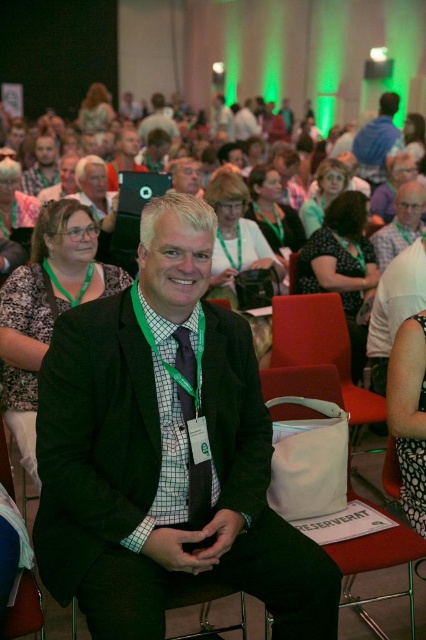
Question: Can you confirm if green woven tie at center is thinner than matte black glasses at center?

Choices:
 (A) no
 (B) yes

Answer: (B)

Question: Which point is closer to the camera?

Choices:
 (A) (37, 189)
 (B) (406, 456)
 (C) (382, 252)
 (D) (230, 257)

Answer: (B)

Question: Where is black textured blazer at center located in relation to matte blue shirt at upper right in the image?

Choices:
 (A) below
 (B) above

Answer: (A)

Question: Which of the following is the farthest from the observer?

Choices:
 (A) tap(379, 134)
 (B) tap(68, 365)

Answer: (A)

Question: Estimate the real-world distances between objects in this image. Which object is farther from the white fabric chair at lower center?

Choices:
 (A) matte black camera at center
 (B) matte black laptop at center
 (C) black textured blazer at center
 (D) dark gray fabric chair at center

Answer: (B)

Question: Is black dotted dress at lower right wider than matte black laptop at left?

Choices:
 (A) yes
 (B) no

Answer: (B)